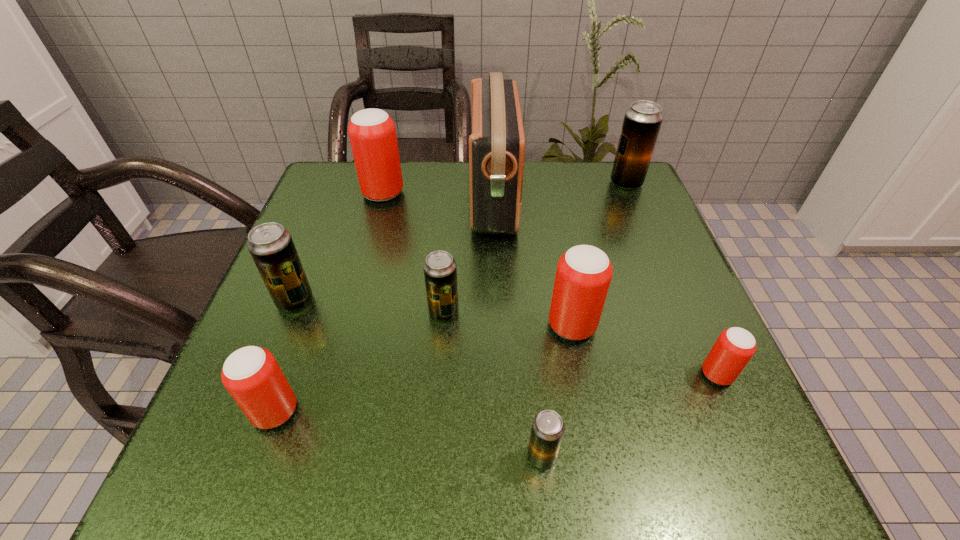
The height and width of the screenshot is (540, 960). What are the coordinates of `the tallest object` in the screenshot? It's located at (497, 143).

Image resolution: width=960 pixels, height=540 pixels. In order to click on the farthest red beer can in this screenshot , I will do `click(372, 133)`.

The width and height of the screenshot is (960, 540). I want to click on the biggest black beer can, so click(642, 121).

Where is `the rightmost black beer can`? The width and height of the screenshot is (960, 540). the rightmost black beer can is located at coordinates (642, 121).

At what (x,y) coordinates should I click in order to perform the action: click on the third beer can from right to left. Please return your answer as a coordinate pair (x, y). Looking at the image, I should click on (584, 272).

This screenshot has width=960, height=540. I want to click on the third smallest red beer can, so click(584, 272).

The height and width of the screenshot is (540, 960). In order to click on the leftmost black beer can in this screenshot , I will do `click(271, 246)`.

Where is `the third biggest black beer can`? This screenshot has width=960, height=540. the third biggest black beer can is located at coordinates (440, 273).

I want to click on the fourth beer can from left to right, so click(440, 273).

The image size is (960, 540). Identify the location of the second nearest object. (251, 374).